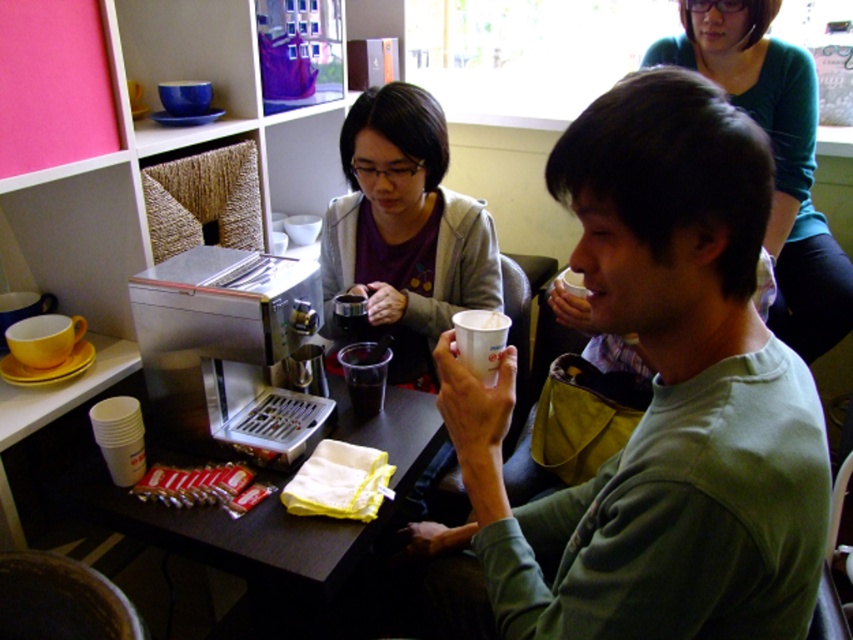
You are trying to place the yellow matte cup at left on top of the stainless steel coffee machine at lower left. Will it fit?

The stainless steel coffee machine at lower left is much taller than the yellow matte cup at left, so placing the yellow matte cup at left on top of the machine may be possible, but it depends on the stability and space available. However, since the machine is taller, the cup might not cover the entire top surface, but it could still fit if the base is wide enough.

You are a barista trying to reach the matte black coffee pot at center to refill it. There is a white paper cup at center in the way. Can you move the cup to access the pot?

The white paper cup at center is closer to the viewer than the matte black coffee pot at center, so moving the cup would allow access to the pot.

You are a barista in a coffee shop and need to place a lid on the white paper cup at center. The lid you have is designed for cups that are at least as tall as the green matte shirt at upper right. Will the lid fit?

The white paper cup at center is shorter than the green matte shirt at upper right. Since the lid is designed for cups at least as tall as the green matte shirt at upper right, the lid will not fit the white paper cup at center.